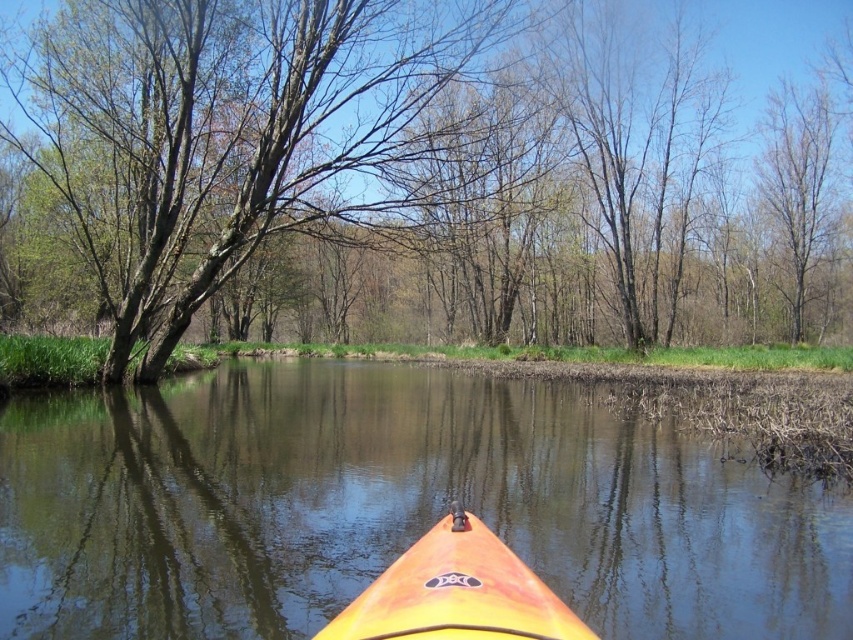
Is orange plastic kayak at center wider than orange matte kayak at center?

Correct, the width of orange plastic kayak at center exceeds that of orange matte kayak at center.

Can you confirm if orange plastic kayak at center is positioned above orange matte kayak at center?

Incorrect, orange plastic kayak at center is not positioned above orange matte kayak at center.

Is point (148, 592) closer to viewer compared to point (381, 618)?

No, it is behind (381, 618).

Where is `orange plastic kayak at center`? The image size is (853, 640). orange plastic kayak at center is located at coordinates (392, 506).

The height and width of the screenshot is (640, 853). What are the coordinates of `brown bark tree at center` in the screenshot? It's located at (416, 173).

Does point (670, 282) come closer to viewer compared to point (399, 595)?

No, (670, 282) is behind (399, 595).

This screenshot has height=640, width=853. In order to click on brown bark tree at center in this screenshot , I will do `click(416, 173)`.

Between point (78, 196) and point (347, 388), which one is positioned in front?

Positioned in front is point (347, 388).

Can you confirm if brown bark tree at center is wider than orange plastic kayak at center?

Correct, the width of brown bark tree at center exceeds that of orange plastic kayak at center.

Where is `brown bark tree at center`? brown bark tree at center is located at coordinates (416, 173).

Locate an element on the screen. The height and width of the screenshot is (640, 853). brown bark tree at center is located at coordinates (416, 173).